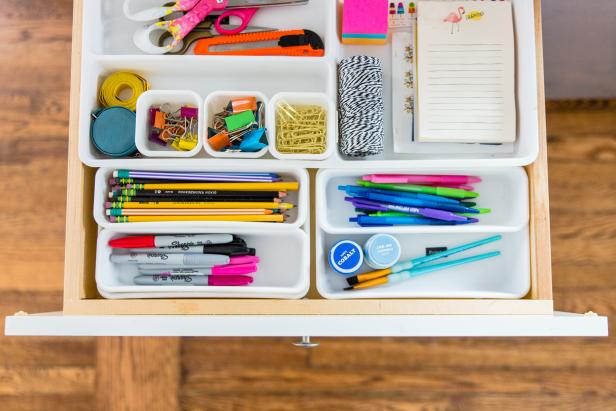
Locate an element on the screen. markers is located at coordinates (238, 281), (241, 270), (249, 257), (209, 261), (225, 250), (185, 240).